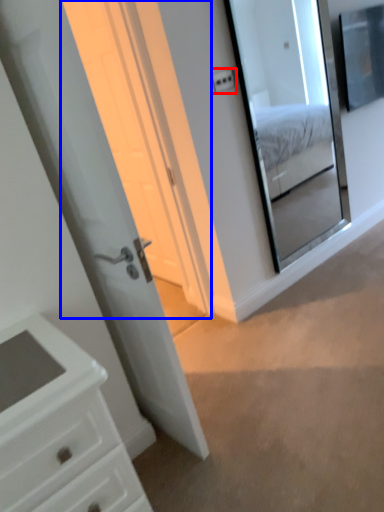
Question: Which of the following is the closest to the observer, light switch (highlighted by a red box) or screen door (highlighted by a blue box)?

Choices:
 (A) light switch
 (B) screen door

Answer: (B)